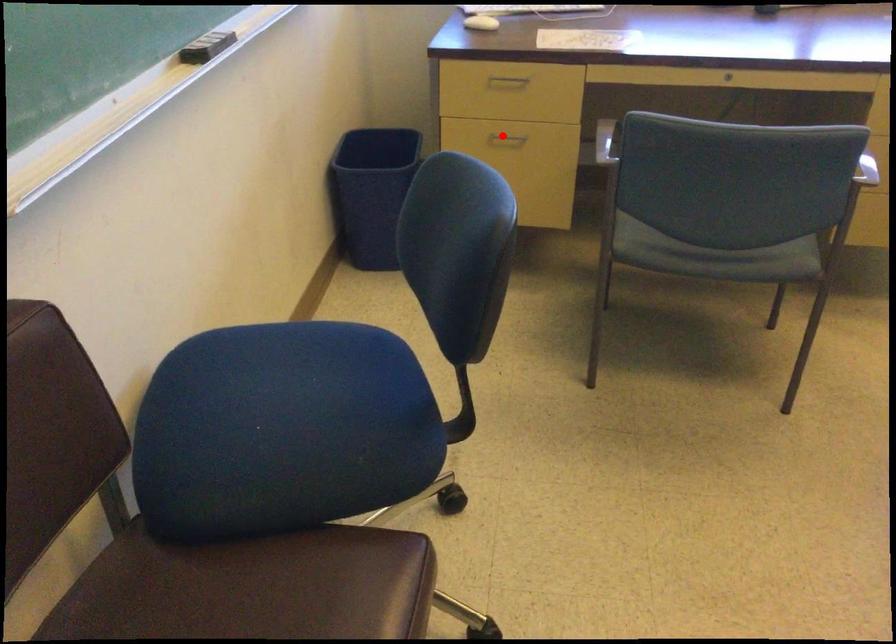
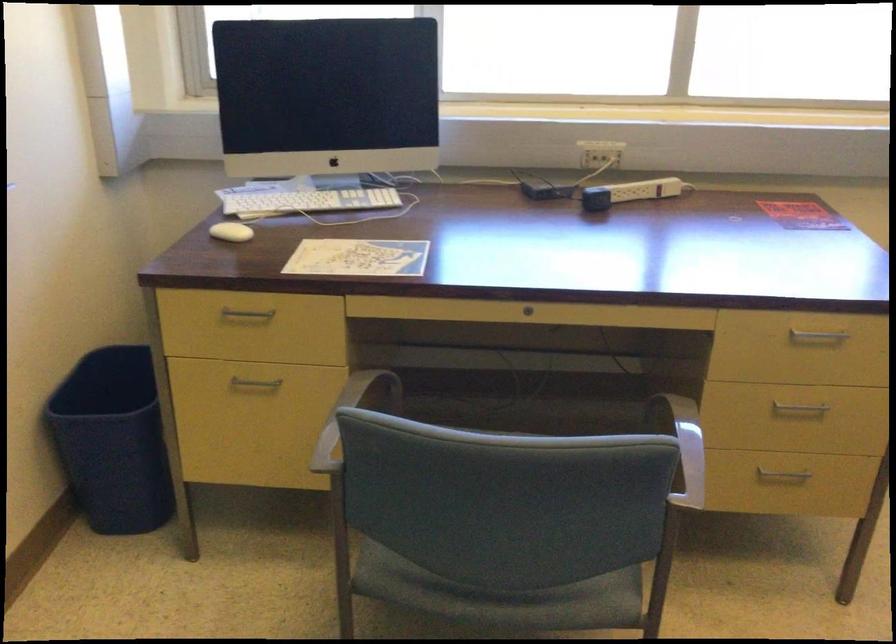
The point at the highlighted location is marked in the first image. Where is the corresponding point in the second image?

(254, 384)